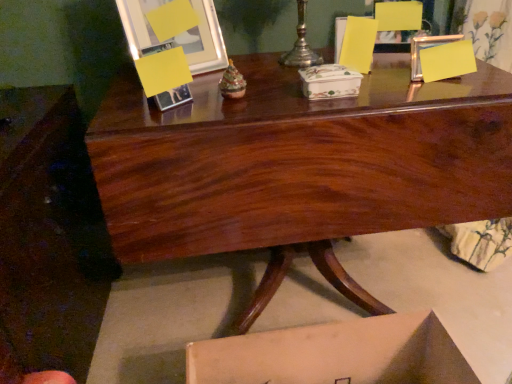
I want to click on vacant space in front of silver metallic candle holder at upper center, so click(x=291, y=79).